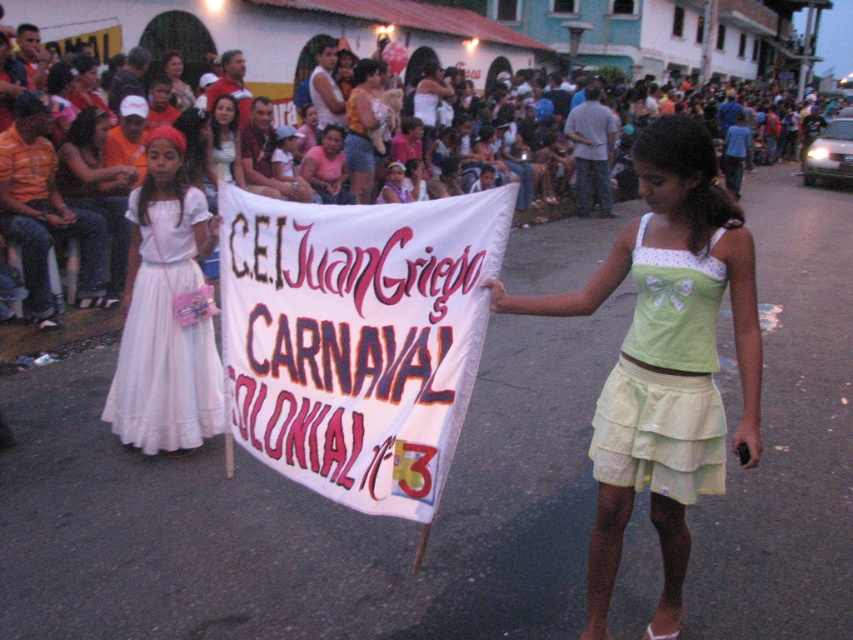
From the picture: Between white cotton clothing at upper center and white satin dress at left, which one appears on the left side from the viewer's perspective?

white satin dress at left

Between white cotton clothing at upper center and white satin dress at left, which one appears on the right side from the viewer's perspective?

white cotton clothing at upper center is more to the right.

Identify the location of white cotton clothing at upper center. The height and width of the screenshot is (640, 853). (427, 33).

Which is in front, point (339, 221) or point (616, 280)?

Point (339, 221) is more forward.

Between white paper banner at center and green polka dot fabric at center, which one appears on the right side from the viewer's perspective?

green polka dot fabric at center is more to the right.

Is point (277, 412) closer to camera compared to point (670, 168)?

No, (277, 412) is further to viewer.

Where is `white paper banner at center`? white paper banner at center is located at coordinates (357, 337).

Does green polka dot fabric at center appear under light green cotton skirt at center?

Indeed, green polka dot fabric at center is positioned under light green cotton skirt at center.

At what (x,y) coordinates should I click in order to perform the action: click on green polka dot fabric at center. Please return your answer as a coordinate pair (x, y). Looking at the image, I should click on (665, 360).

Where is `green polka dot fabric at center`? green polka dot fabric at center is located at coordinates (665, 360).